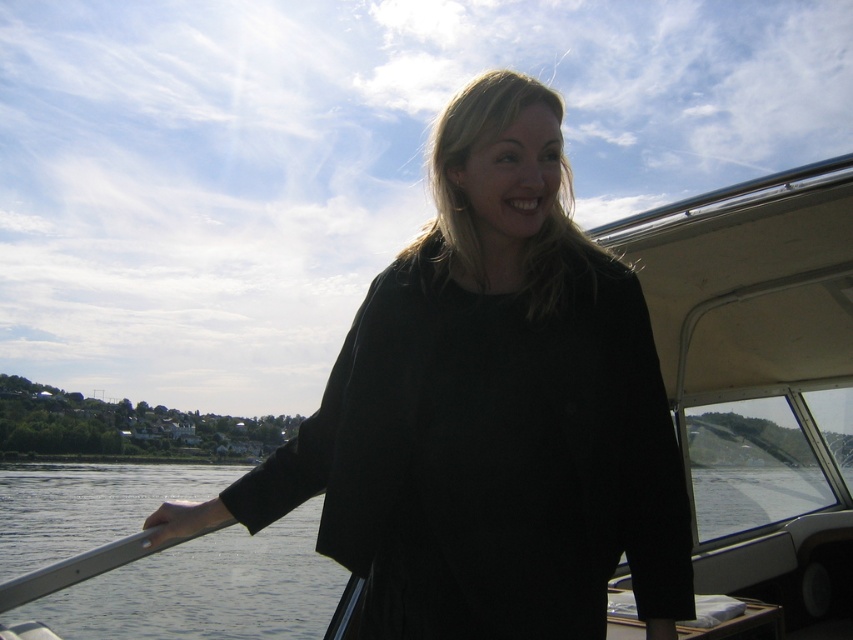
Can you confirm if black matte dress at center is shorter than transparent water at lower left?

No, black matte dress at center is not shorter than transparent water at lower left.

Does black matte dress at center lie behind transparent water at lower left?

No, black matte dress at center is in front of transparent water at lower left.

You are a GUI agent. You are given a task and a screenshot of the screen. Output one action in this format:
    pyautogui.click(x=<x>, y=<y>)
    Task: Click on the black matte dress at center
    Image resolution: width=853 pixels, height=640 pixels.
    Given the screenshot: What is the action you would take?
    pyautogui.click(x=489, y=412)